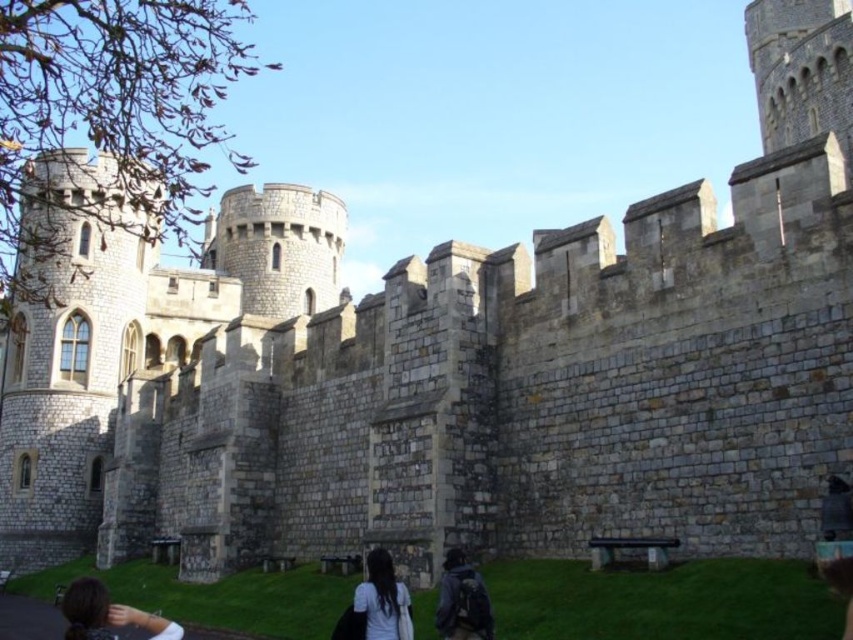
From the picture: Between dark gray backpack at lower center and white matte shirt at lower center, which one is positioned lower?

white matte shirt at lower center is lower down.

Does dark gray backpack at lower center appear on the left side of white matte shirt at lower center?

Incorrect, dark gray backpack at lower center is not on the left side of white matte shirt at lower center.

Is point (445, 595) positioned behind point (364, 637)?

Yes.

Locate an element on the screen. This screenshot has height=640, width=853. dark gray backpack at lower center is located at coordinates (462, 600).

Does dark brown hair at lower left appear over white matte shirt at lower center?

No, dark brown hair at lower left is not above white matte shirt at lower center.

Which is in front, point (67, 616) or point (386, 628)?

Point (67, 616) is more forward.

Who is more distant from viewer, [96,582] or [370,593]?

The point [370,593] is more distant.

The width and height of the screenshot is (853, 640). I want to click on dark brown hair at lower left, so click(x=107, y=614).

Can you confirm if dark brown hair at lower left is positioned to the left of dark gray backpack at lower center?

Yes, dark brown hair at lower left is to the left of dark gray backpack at lower center.

Which is behind, point (140, 625) or point (468, 573)?

Positioned behind is point (468, 573).

Locate an element on the screen. Image resolution: width=853 pixels, height=640 pixels. dark brown hair at lower left is located at coordinates (107, 614).